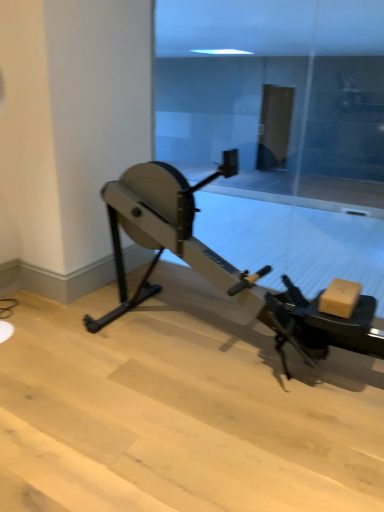
Question: From a real-world perspective, is metallic gray stationary bicycle at center positioned above or below transparent glass door at center?

Choices:
 (A) above
 (B) below

Answer: (B)

Question: Based on their sizes in the image, would you say metallic gray stationary bicycle at center is bigger or smaller than transparent glass door at center?

Choices:
 (A) big
 (B) small

Answer: (A)

Question: Does point (173, 175) appear closer or farther from the camera than point (372, 175)?

Choices:
 (A) farther
 (B) closer

Answer: (B)

Question: Does point (205, 138) appear closer or farther from the camera than point (135, 221)?

Choices:
 (A) farther
 (B) closer

Answer: (A)

Question: From a real-world perspective, is transparent glass door at center above or below metallic gray stationary bicycle at center?

Choices:
 (A) above
 (B) below

Answer: (A)

Question: From their relative heights in the image, would you say transparent glass door at center is taller or shorter than metallic gray stationary bicycle at center?

Choices:
 (A) short
 (B) tall

Answer: (B)

Question: From the image's perspective, relative to metallic gray stationary bicycle at center, is transparent glass door at center above or below?

Choices:
 (A) above
 (B) below

Answer: (A)